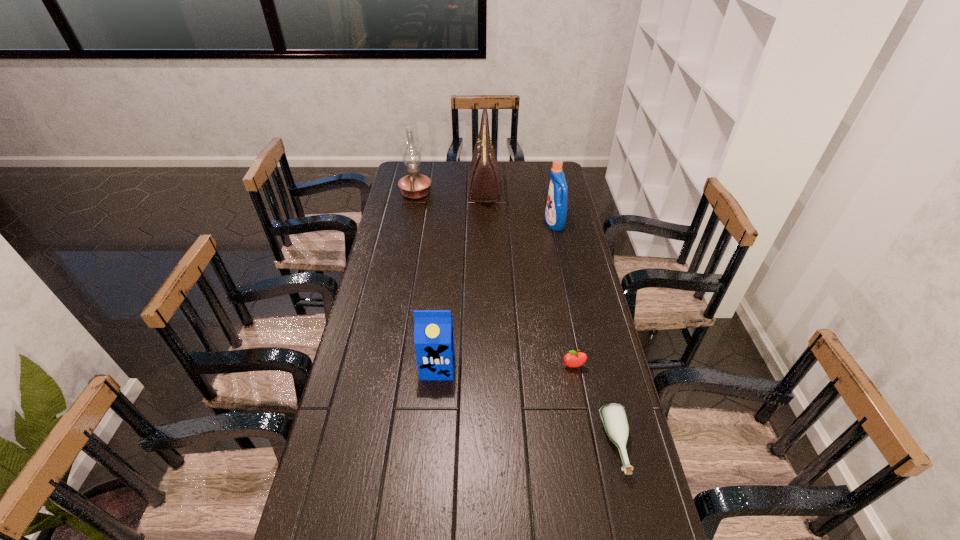
I want to click on vacant space positioned on the front-facing side of the fourth object from right to left, so click(419, 188).

Where is `vacant space positioned on the front of the leftmost object`? The width and height of the screenshot is (960, 540). vacant space positioned on the front of the leftmost object is located at coordinates (413, 208).

Find the location of a particular element. Image resolution: width=960 pixels, height=540 pixels. vacant space located 0.150m on the label of the third farthest object is located at coordinates (511, 224).

Where is `vacant space located on the label of the third farthest object`? vacant space located on the label of the third farthest object is located at coordinates (503, 224).

Locate an element on the screen. free spot located on the label of the third farthest object is located at coordinates [x=468, y=224].

Where is `free space located with the cap open on the fifth object from right to left`? free space located with the cap open on the fifth object from right to left is located at coordinates pos(424,521).

Image resolution: width=960 pixels, height=540 pixels. What are the coordinates of `free space located 0.290m on the back of the apple` in the screenshot? It's located at (561, 296).

I want to click on free space located on the back of the bottle, so click(588, 323).

The width and height of the screenshot is (960, 540). In order to click on handbag positioned at the far edge in this screenshot , I will do `click(484, 184)`.

You are a GUI agent. You are given a task and a screenshot of the screen. Output one action in this format:
    pyautogui.click(x=<x>, y=<y>)
    Task: Click on the oil lamp that is at the far edge
    The image size is (960, 540).
    Given the screenshot: What is the action you would take?
    pyautogui.click(x=413, y=186)